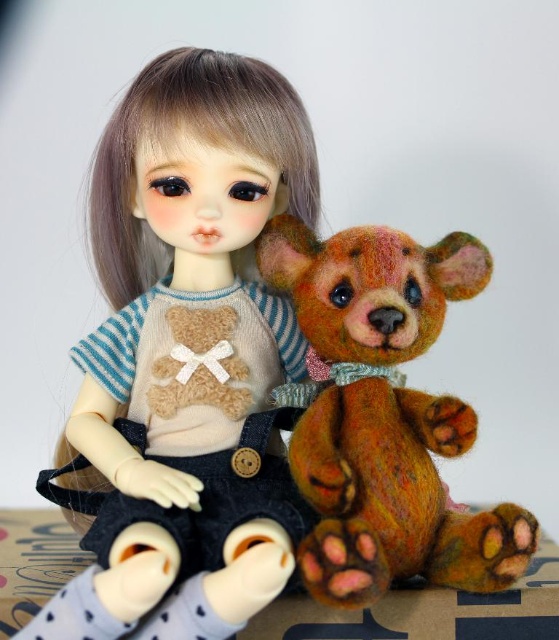
You are a photographer trying to capture the perfect shot of the doll and the teddy bear. You notice a specific point at coordinates point (187, 355). Where exactly is this point located on the doll?

The point (187, 355) is on the matte beige doll at center.

You are a toy organizer in a store. You have to place the matte beige doll at center and the textured brown bear at center on a shelf. The shelf has a height limit of 15 inches. If the bear is 10 inches tall, will both items fit on the shelf?

The matte beige doll at center is much taller than the textured brown bear at center. Since the bear is 10 inches tall, the doll must be taller than 10 inches. The shelf has a height limit of 15 inches, so if the doll exceeds 15 inches, it won